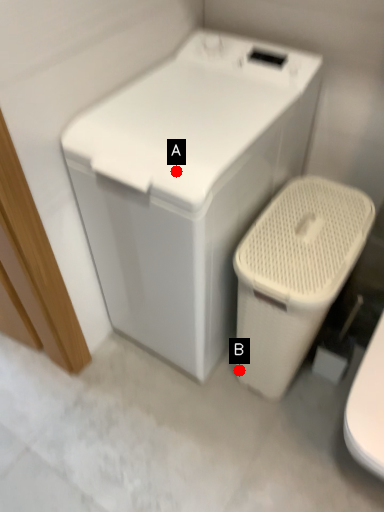
Question: Two points are circled on the image, labeled by A and B beside each circle. Which point is closer to the camera?

Choices:
 (A) A is closer
 (B) B is closer

Answer: (A)